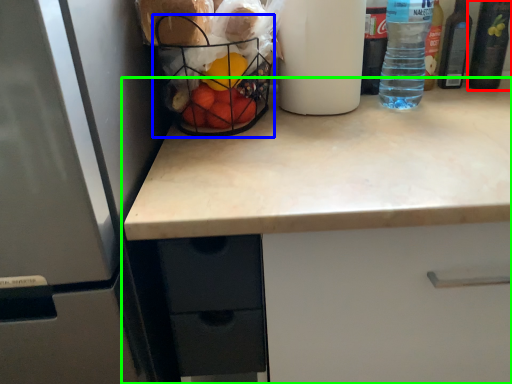
Question: Estimate the real-world distances between objects in this image. Which object is farther from bottle (highlighted by a red box), basket (highlighted by a blue box) or countertop (highlighted by a green box)?

Choices:
 (A) basket
 (B) countertop

Answer: (A)